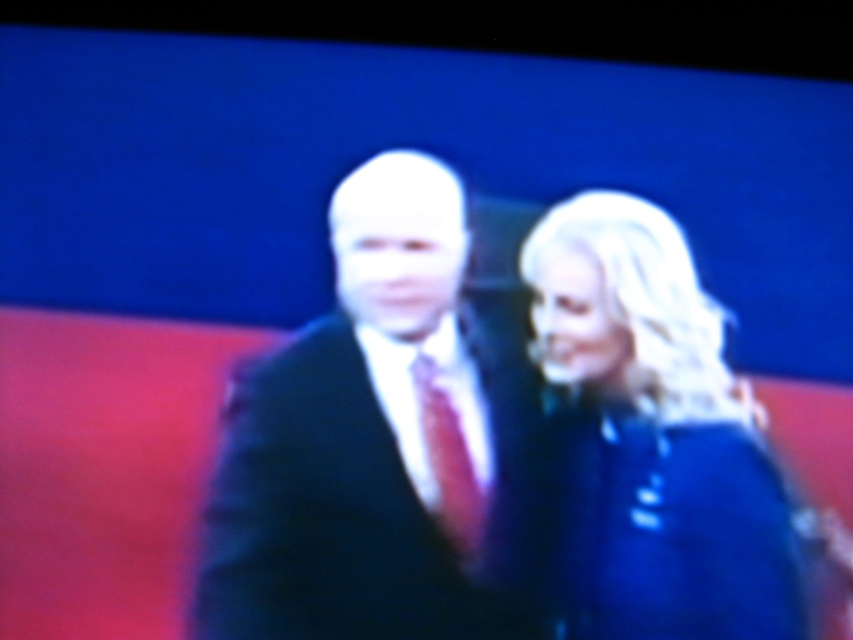
In the scene shown: You are a costume designer preparing for a play and need to decide which outfit to use for a scene where the actor needs to appear more dominant. Based on the image, which outfit between the matte black suit at center and the shiny blue coat at right would you choose and why?

The matte black suit at center has a larger size compared to the shiny blue coat at right. Larger outfits can convey a sense of dominance, so the matte black suit at center would be the better choice for the dominant character.